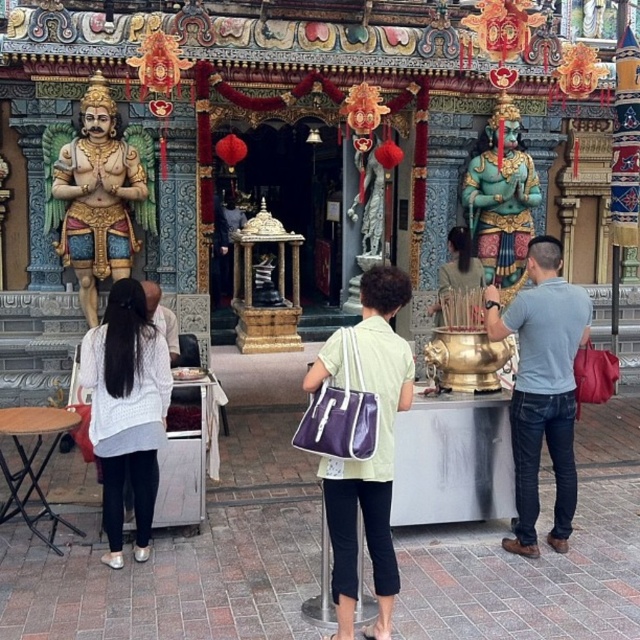
Is white knitted sweater at left wider than white matte shirt at center?

Correct, the width of white knitted sweater at left exceeds that of white matte shirt at center.

Is white knitted sweater at left thinner than white matte shirt at center?

No, white knitted sweater at left is not thinner than white matte shirt at center.

Between point (150, 460) and point (177, 356), which one is positioned behind?

Point (177, 356)

Find the location of a particular element. white knitted sweater at left is located at coordinates (125, 410).

Can you confirm if purple fabric bag at center is bigger than gold polished statue at left?

Incorrect, purple fabric bag at center is not larger than gold polished statue at left.

Does purple fabric bag at center come in front of gold polished statue at left?

Yes, it is.

I want to click on purple fabric bag at center, so coord(371,458).

Who is higher up, gold polished statue at left or white matte shirt at center?

gold polished statue at left is above.

Describe the element at coordinates (97, 196) in the screenshot. The height and width of the screenshot is (640, 640). I see `gold polished statue at left` at that location.

Locate an element on the screen. gold polished statue at left is located at coordinates click(97, 196).